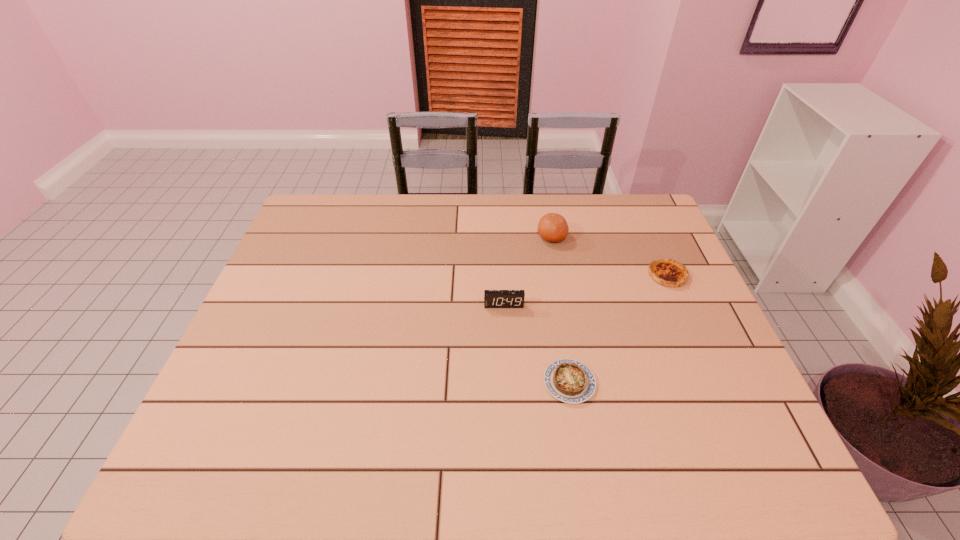
Locate an element on the screen. vacant space that satisfies the following two spatial constraints: 1. on the front side of the third nearest object; 2. on the right side of the farthest object is located at coordinates (559, 275).

Where is `vacant area that satisfies the following two spatial constraints: 1. on the front-facing side of the leftmost object; 2. on the right side of the nearer quiche`? The width and height of the screenshot is (960, 540). vacant area that satisfies the following two spatial constraints: 1. on the front-facing side of the leftmost object; 2. on the right side of the nearer quiche is located at coordinates (508, 383).

This screenshot has height=540, width=960. In order to click on vacant position in the image that satisfies the following two spatial constraints: 1. on the back side of the clementine; 2. on the right side of the nearer quiche in this screenshot , I will do `click(545, 238)`.